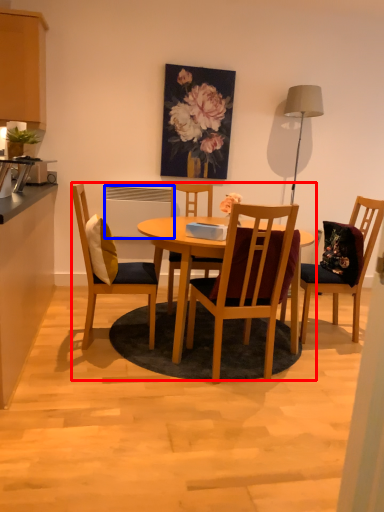
Question: Which point is closer to the camera, kitchen & dining room table (highlighted by a red box) or appliance (highlighted by a blue box)?

Choices:
 (A) kitchen & dining room table
 (B) appliance

Answer: (A)